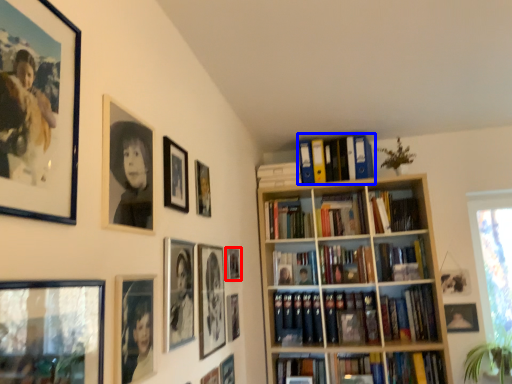
Question: Among these objects, which one is farthest to the camera, picture frame (highlighted by a red box) or book (highlighted by a blue box)?

Choices:
 (A) picture frame
 (B) book

Answer: (B)